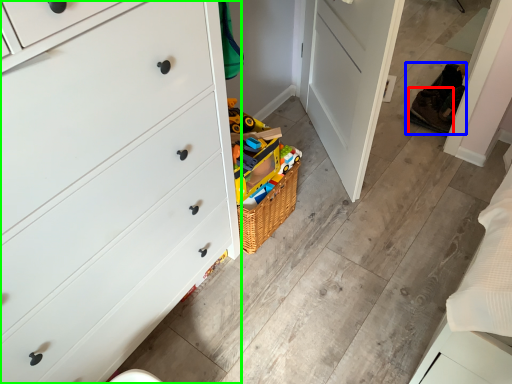
Question: Estimate the real-world distances between objects in this image. Which object is farther from shoe (highlighted by a red box), shoe (highlighted by a blue box) or chest of drawers (highlighted by a green box)?

Choices:
 (A) shoe
 (B) chest of drawers

Answer: (B)